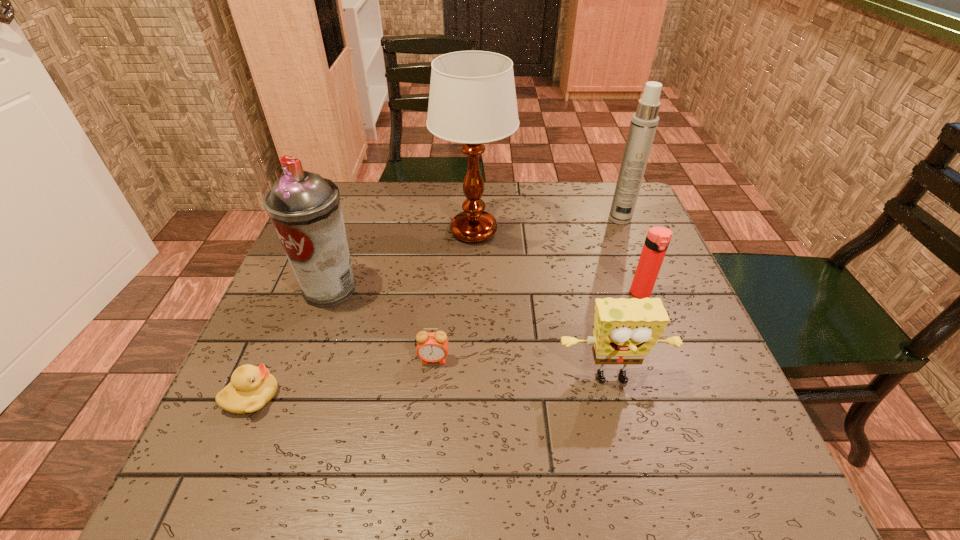
The width and height of the screenshot is (960, 540). In order to click on table lamp in this screenshot , I will do `click(472, 100)`.

Locate an element on the screen. Image resolution: width=960 pixels, height=540 pixels. the farther aerosol can is located at coordinates (644, 122).

The image size is (960, 540). Identify the location of the nearer aerosol can. (305, 209).

Identify the location of sponge. The width and height of the screenshot is (960, 540). (625, 330).

This screenshot has width=960, height=540. Find the location of `thermos bottle`. thermos bottle is located at coordinates [x=657, y=240].

Locate an element on the screen. Image resolution: width=960 pixels, height=540 pixels. alarm clock is located at coordinates (432, 347).

Identify the location of the shortest object. The height and width of the screenshot is (540, 960). (251, 388).

The width and height of the screenshot is (960, 540). In order to click on free space located 0.370m on the front of the table lamp in this screenshot , I will do `click(471, 387)`.

This screenshot has width=960, height=540. Find the location of `blank space located 0.340m on the front of the right aerosol can`. blank space located 0.340m on the front of the right aerosol can is located at coordinates click(x=661, y=322).

Image resolution: width=960 pixels, height=540 pixels. Find the location of `blank space located on the right of the nearer aerosol can`. blank space located on the right of the nearer aerosol can is located at coordinates (459, 288).